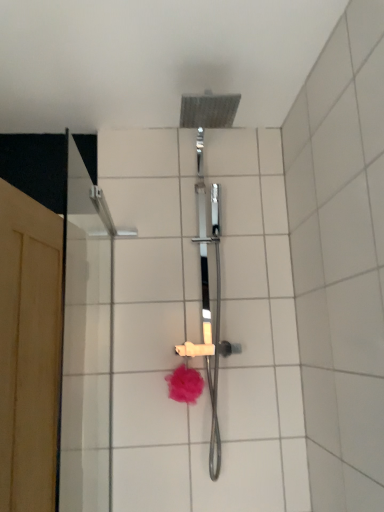
Question: Considering the relative positions of white ceramic tile at upper center and pink fluffy bath puff at center in the image provided, is white ceramic tile at upper center to the left of pink fluffy bath puff at center from the viewer's perspective?

Choices:
 (A) no
 (B) yes

Answer: (A)

Question: Can pink fluffy bath puff at center be found inside white ceramic tile at upper center?

Choices:
 (A) no
 (B) yes

Answer: (A)

Question: From the image's perspective, does white ceramic tile at upper center appear lower than pink fluffy bath puff at center?

Choices:
 (A) no
 (B) yes

Answer: (A)

Question: Is white ceramic tile at upper center to the right of pink fluffy bath puff at center from the viewer's perspective?

Choices:
 (A) yes
 (B) no

Answer: (A)

Question: Does white ceramic tile at upper center have a larger size compared to pink fluffy bath puff at center?

Choices:
 (A) yes
 (B) no

Answer: (A)

Question: Would you consider white ceramic tile at upper center to be distant from pink fluffy bath puff at center?

Choices:
 (A) no
 (B) yes

Answer: (A)

Question: Is pink fluffy bath puff at center inside wooden screen door at left?

Choices:
 (A) no
 (B) yes

Answer: (A)

Question: Considering the relative positions of wooden screen door at left and pink fluffy bath puff at center in the image provided, is wooden screen door at left to the left of pink fluffy bath puff at center from the viewer's perspective?

Choices:
 (A) yes
 (B) no

Answer: (A)

Question: Is the position of wooden screen door at left more distant than that of pink fluffy bath puff at center?

Choices:
 (A) no
 (B) yes

Answer: (A)

Question: Is wooden screen door at left outside of pink fluffy bath puff at center?

Choices:
 (A) no
 (B) yes

Answer: (B)

Question: From a real-world perspective, is wooden screen door at left physically above pink fluffy bath puff at center?

Choices:
 (A) yes
 (B) no

Answer: (A)

Question: Can you confirm if wooden screen door at left is thinner than pink fluffy bath puff at center?

Choices:
 (A) yes
 (B) no

Answer: (B)

Question: Considering the relative positions of pink fluffy bath puff at center and white ceramic tile at upper center in the image provided, is pink fluffy bath puff at center to the right of white ceramic tile at upper center from the viewer's perspective?

Choices:
 (A) yes
 (B) no

Answer: (B)